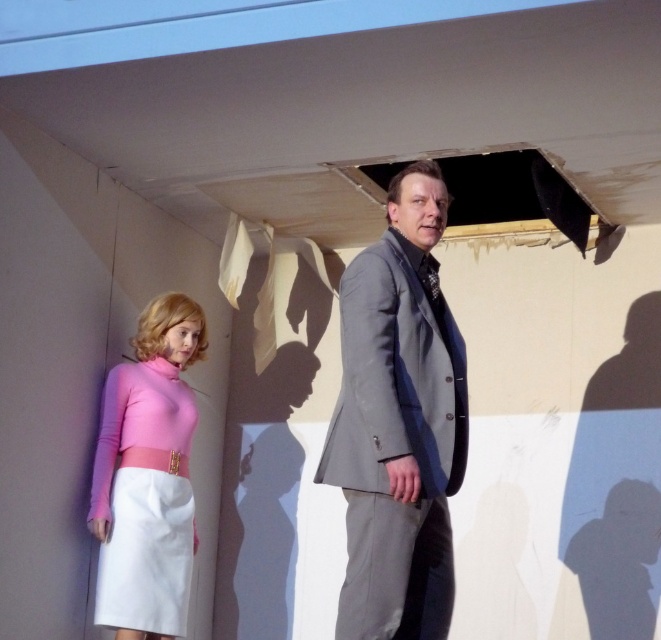
Question: From the image, what is the correct spatial relationship of gray wool suit at center in relation to pink matte fabric dress at lower left?

Choices:
 (A) right
 (B) left

Answer: (A)

Question: Can you confirm if gray wool suit at center is wider than pink matte fabric dress at lower left?

Choices:
 (A) no
 (B) yes

Answer: (B)

Question: Which of the following is the farthest from the observer?

Choices:
 (A) (366, 420)
 (B) (134, 428)

Answer: (B)

Question: Which object appears farthest from the camera in this image?

Choices:
 (A) pink matte fabric dress at lower left
 (B) gray wool suit at center

Answer: (A)

Question: Does gray wool suit at center have a lesser width compared to pink matte fabric dress at lower left?

Choices:
 (A) yes
 (B) no

Answer: (B)